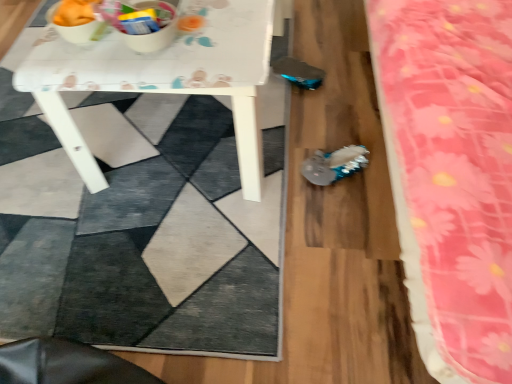
Question: In terms of width, does shiny metallic shoe at center look wider or thinner when compared to pink floral fabric at right?

Choices:
 (A) wide
 (B) thin

Answer: (B)

Question: Considering their positions, is shiny metallic shoe at center located in front of or behind pink floral fabric at right?

Choices:
 (A) behind
 (B) front

Answer: (A)

Question: Considering the real-world distances, which object is farthest from the shiny metallic shoe at center?

Choices:
 (A) pink floral fabric at right
 (B) white glossy table at center

Answer: (A)

Question: Which object is the closest to the pink floral fabric at right?

Choices:
 (A) shiny metallic shoe at center
 (B) white glossy table at center

Answer: (A)